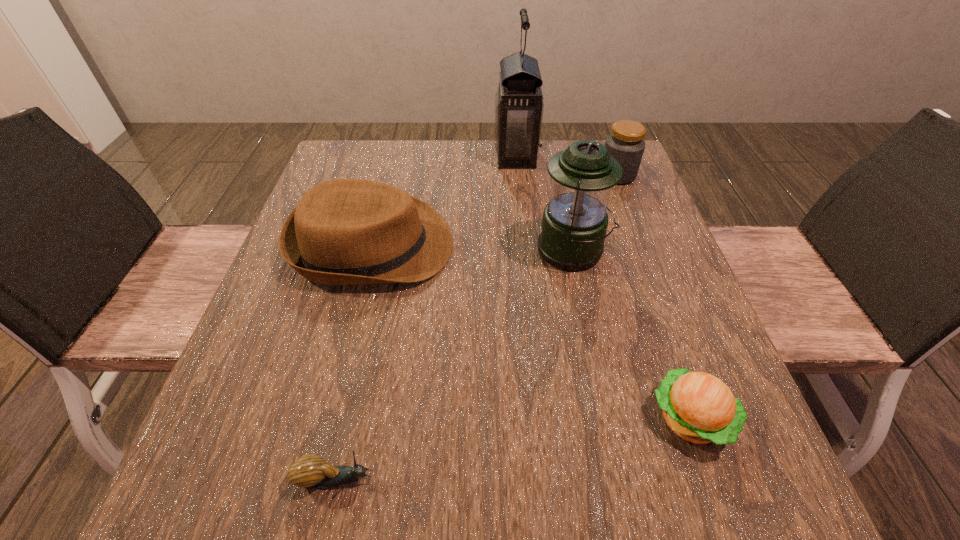
Find the location of a particular element. The width and height of the screenshot is (960, 540). vacant space that is in between the hamburger and the shortest object is located at coordinates (513, 449).

At what (x,y) coordinates should I click in order to perform the action: click on free spot between the fifth shortest object and the second shortest object. Please return your answer as a coordinate pair (x, y). This screenshot has width=960, height=540. Looking at the image, I should click on (632, 335).

The image size is (960, 540). In order to click on free space between the fedora and the escargot in this screenshot , I will do `click(354, 362)`.

At what (x,y) coordinates should I click in order to perform the action: click on vacant area that lies between the shortest object and the jar. Please return your answer as a coordinate pair (x, y). Looking at the image, I should click on (476, 327).

Locate an element on the screen. The width and height of the screenshot is (960, 540). free space between the second nearest object and the farther lantern is located at coordinates pos(603,287).

You are a GUI agent. You are given a task and a screenshot of the screen. Output one action in this format:
    pyautogui.click(x=<x>, y=<y>)
    Task: Click on the free space that is in between the tallest object and the fedora
    The width and height of the screenshot is (960, 540).
    Given the screenshot: What is the action you would take?
    pyautogui.click(x=444, y=201)

You are a GUI agent. You are given a task and a screenshot of the screen. Output one action in this format:
    pyautogui.click(x=<x>, y=<y>)
    Task: Click on the object that ranks as the second closest to the fifth shortest object
    The image size is (960, 540).
    Given the screenshot: What is the action you would take?
    pyautogui.click(x=346, y=231)

Select which object is the third closest to the shorter lantern. Please provide its 2D coordinates. Your answer should be formatted as a tuple, i.e. [(x, y)], where the tuple contains the x and y coordinates of a point satisfying the conditions above.

[(519, 105)]

The width and height of the screenshot is (960, 540). Identify the location of blank space that satisfies the following two spatial constraints: 1. on the front-facing side of the farther lantern; 2. on the back side of the hamburger. (544, 418).

The height and width of the screenshot is (540, 960). Identify the location of free space in the image that satisfies the following two spatial constraints: 1. on the front-facing side of the fedora; 2. on the right side of the shorter lantern. (372, 251).